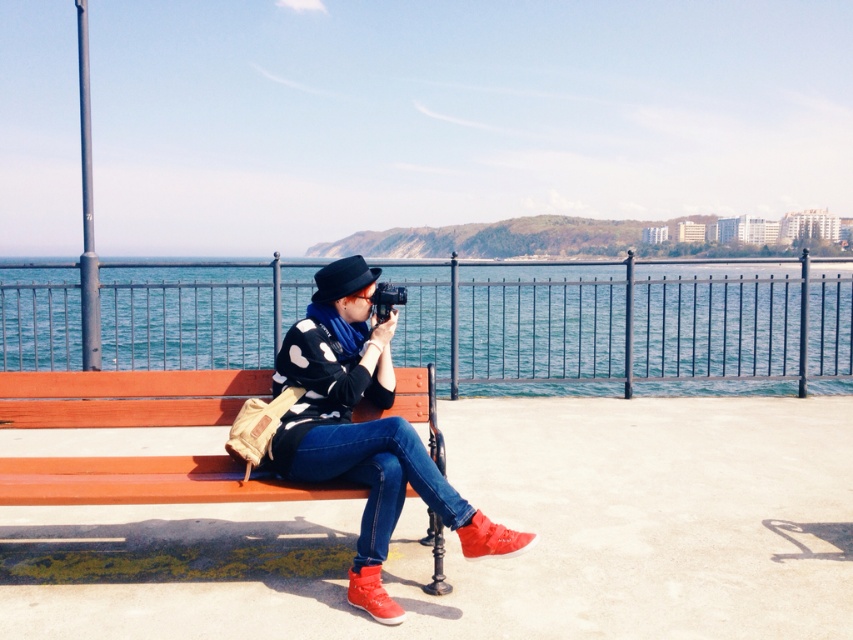
How distant is blue water at center from polka dot sweater at center?

They are 4.94 meters apart.

The image size is (853, 640). Describe the element at coordinates (624, 323) in the screenshot. I see `blue water at center` at that location.

Locate an element on the screen. blue water at center is located at coordinates (624, 323).

Which is more to the left, polka dot sweater at center or wooden bench at center?

From the viewer's perspective, wooden bench at center appears more on the left side.

Who is more distant from viewer, [372,461] or [167,376]?

The point [167,376] is more distant.

This screenshot has height=640, width=853. Identify the location of polka dot sweater at center. (363, 429).

Which is behind, point (509, 378) or point (102, 404)?

The point (509, 378) is behind.

What do you see at coordinates (624, 323) in the screenshot? I see `blue water at center` at bounding box center [624, 323].

The height and width of the screenshot is (640, 853). I want to click on blue water at center, so click(x=624, y=323).